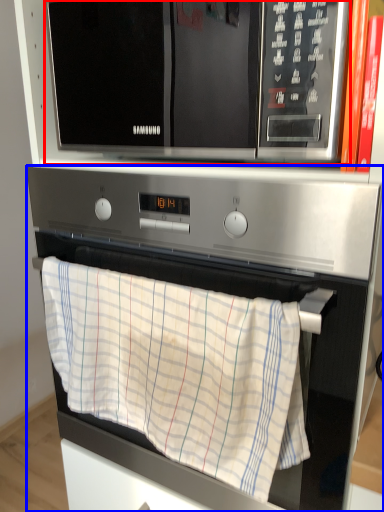
Question: Which point is further to the camera, microwave oven (highlighted by a red box) or oven (highlighted by a blue box)?

Choices:
 (A) microwave oven
 (B) oven

Answer: (B)